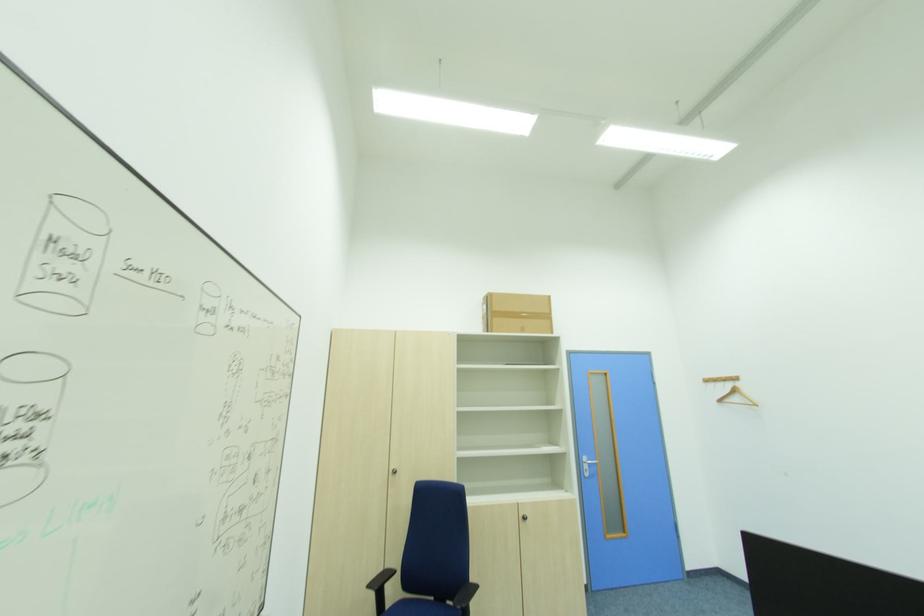
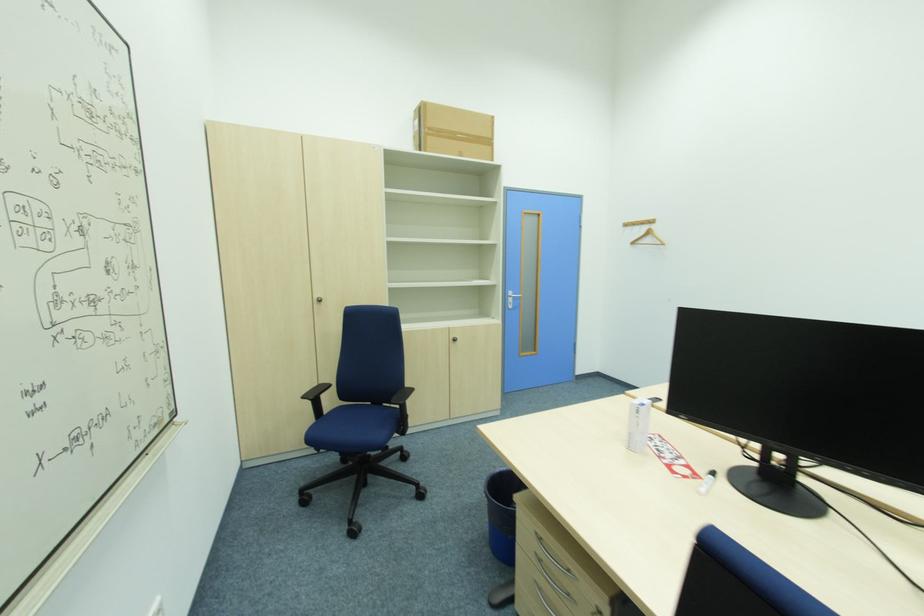
Question: How did the camera likely rotate?

Choices:
 (A) Left
 (B) Right
 (C) Up
 (D) Down

Answer: (D)